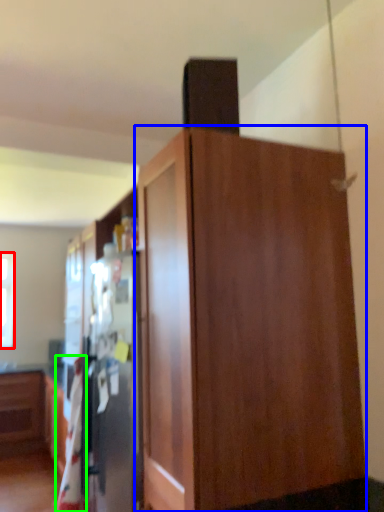
Question: Which is nearer to the window (highlighted by a red box)? cupboard (highlighted by a blue box) or blanket (highlighted by a green box).

Choices:
 (A) cupboard
 (B) blanket

Answer: (B)